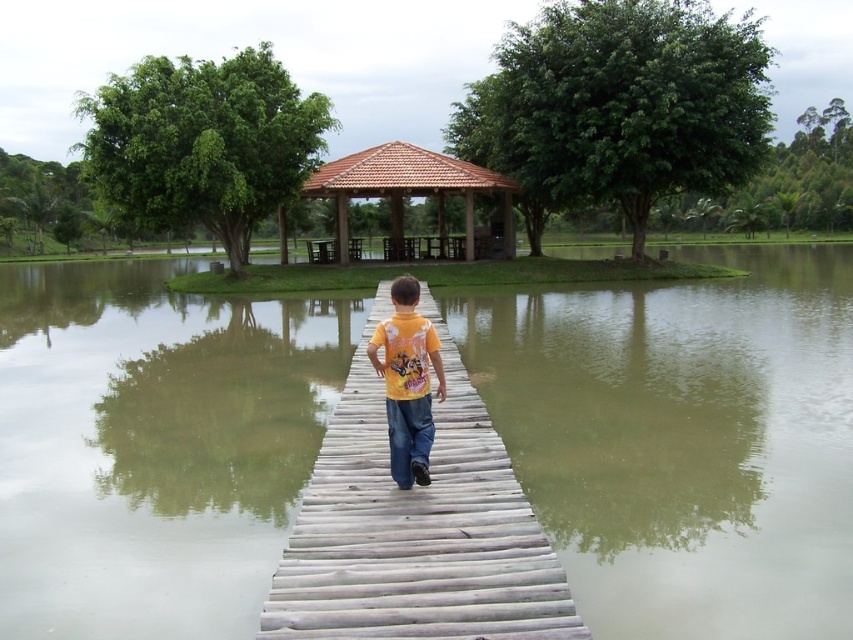
Question: Is wooden bridge at center to the left of yellow cotton shirt at center from the viewer's perspective?

Choices:
 (A) yes
 (B) no

Answer: (B)

Question: Is wooden bridge at center to the right of brown tiled gazebo at center from the viewer's perspective?

Choices:
 (A) no
 (B) yes

Answer: (A)

Question: Is brown tiled gazebo at center positioned before yellow cotton shirt at center?

Choices:
 (A) yes
 (B) no

Answer: (B)

Question: Which object appears farthest from the camera in this image?

Choices:
 (A) greenish-brown wooden bridge at center
 (B) brown tiled gazebo at center

Answer: (B)

Question: Which point appears closest to the camera in this image?

Choices:
 (A) (236, 595)
 (B) (432, 440)

Answer: (B)

Question: Which object is farther from the camera taking this photo?

Choices:
 (A) wooden bridge at center
 (B) brown tiled gazebo at center
 (C) greenish-brown wooden bridge at center

Answer: (B)